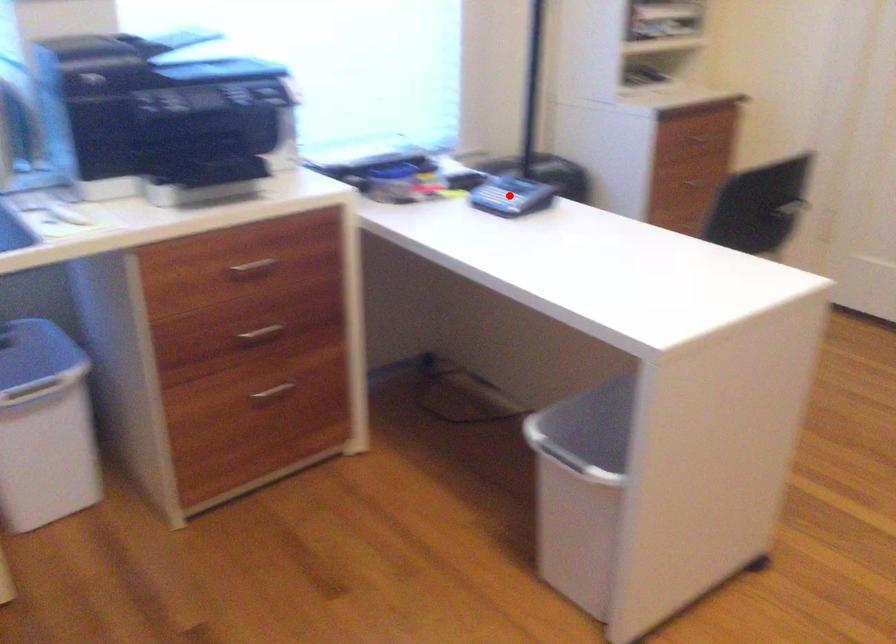
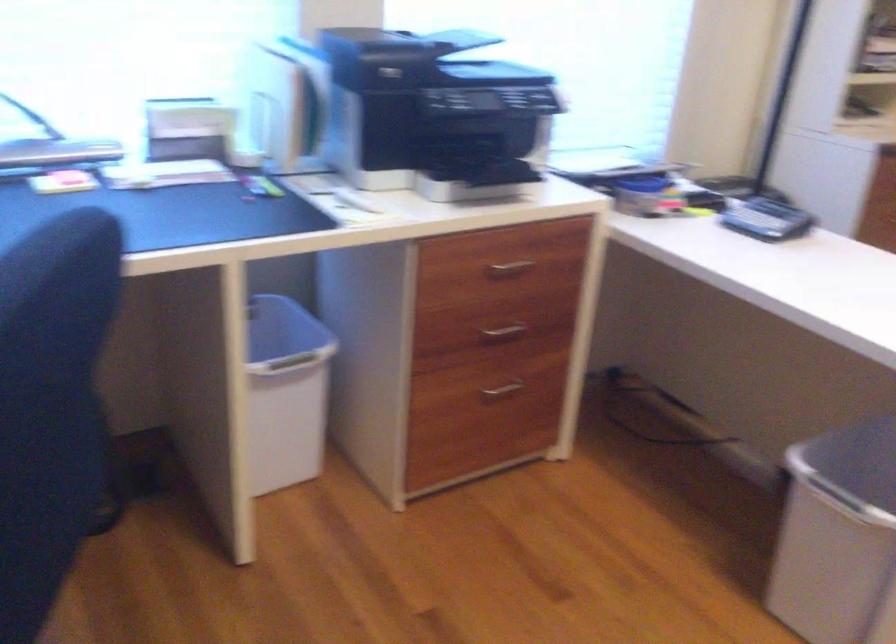
Locate, in the second image, the point that corresponds to the highlighted location in the first image.

(767, 220)